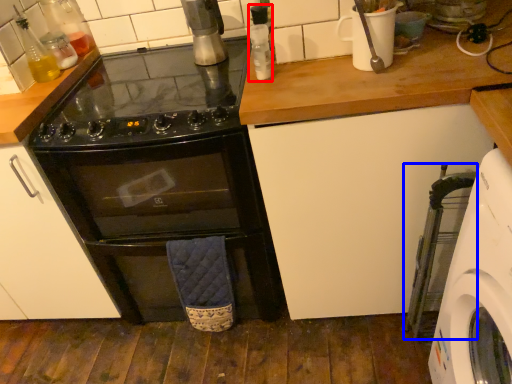
Question: Which of the following is the farthest to the observer, bottle (highlighted by a red box) or appliance (highlighted by a blue box)?

Choices:
 (A) bottle
 (B) appliance

Answer: (A)